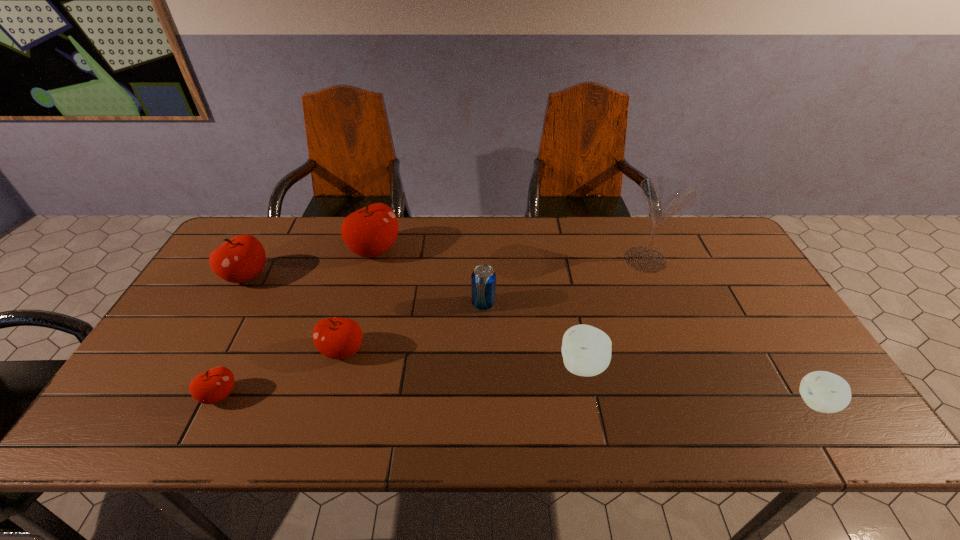
You are a GUI agent. You are given a task and a screenshot of the screen. Output one action in this format:
    pyautogui.click(x=<x>, y=<y>)
    Task: Click on the vacant region that satisfies the following two spatial constraints: 1. on the back side of the bigger white apple; 2. on the left side of the smallest red apple
    This screenshot has height=540, width=960.
    Given the screenshot: What is the action you would take?
    pyautogui.click(x=234, y=366)

The width and height of the screenshot is (960, 540). I want to click on free region that satisfies the following two spatial constraints: 1. on the front side of the rightmost apple; 2. on the right side of the tallest apple, so click(333, 403).